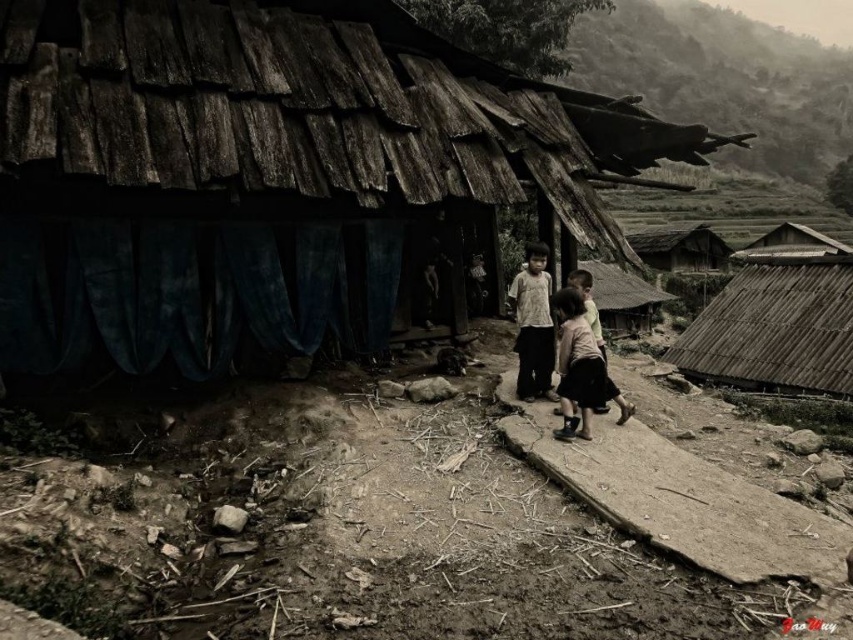
Describe the element at coordinates (775, 328) in the screenshot. The width and height of the screenshot is (853, 640). I see `wooden shingles hut at upper right` at that location.

Who is taller, wooden shingles hut at upper right or thatched roof hut at upper right?

Standing taller between the two is thatched roof hut at upper right.

I want to click on wooden shingles hut at upper right, so pyautogui.click(x=775, y=328).

Locate an element on the screen. wooden shingles hut at upper right is located at coordinates pos(775,328).

Between light brown cotton dress at center and thatched roof hut at upper right, which one has more height?

Standing taller between the two is thatched roof hut at upper right.

Describe the element at coordinates (576, 365) in the screenshot. I see `light brown cotton dress at center` at that location.

The height and width of the screenshot is (640, 853). Find the location of `light brown cotton dress at center`. light brown cotton dress at center is located at coordinates (576, 365).

In the scene shown: Is wooden shingles hut at center thinner than wooden thatched hut at center?

Yes.

Between wooden shingles hut at center and wooden thatched hut at center, which one is positioned lower?

Positioned lower is wooden shingles hut at center.

You are a GUI agent. You are given a task and a screenshot of the screen. Output one action in this format:
    pyautogui.click(x=<x>, y=<y>)
    Task: Click on the wooden shingles hut at center
    This screenshot has width=853, height=640.
    Given the screenshot: What is the action you would take?
    pyautogui.click(x=276, y=179)